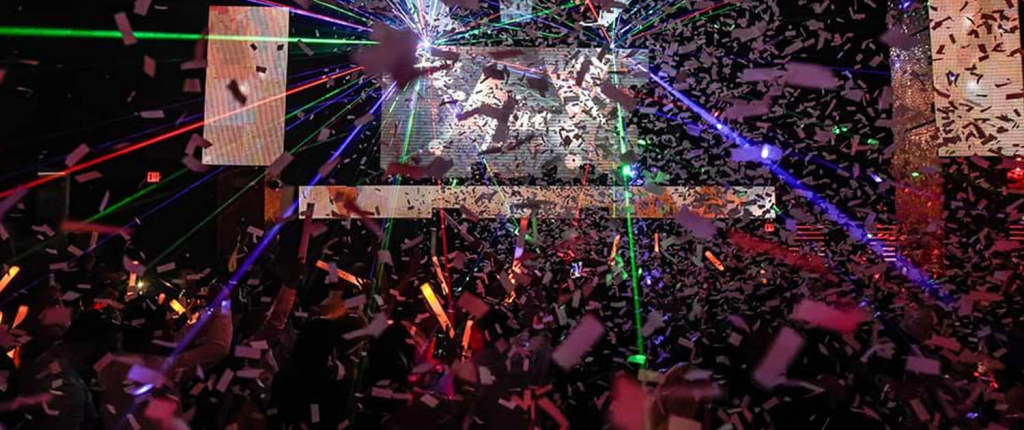
Identify the location of black/dark room. This screenshot has width=1024, height=430. (155, 229).